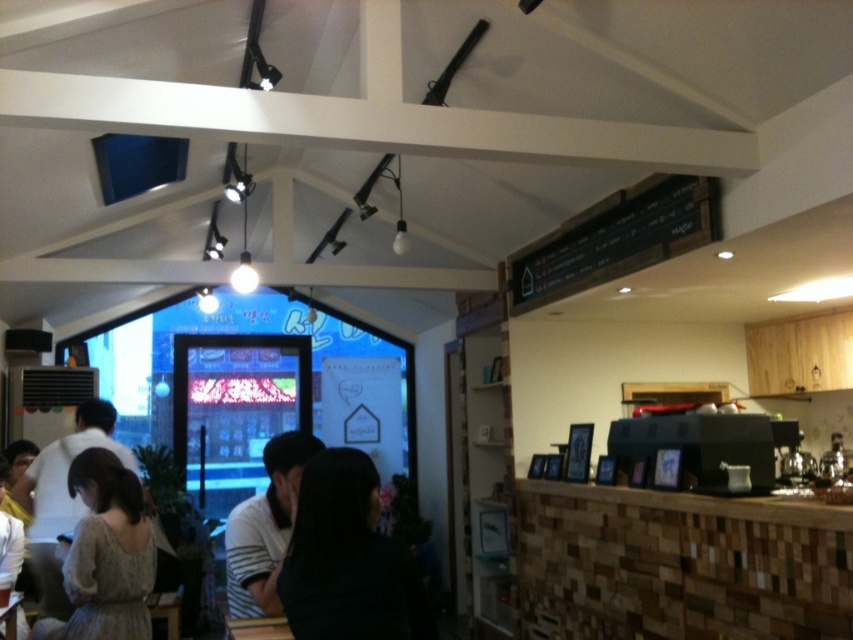
You are a customer in the cozy cafe and you see a knitted sweater at lower left and a white striped shirt at center. Which clothing item is larger in size?

The knitted sweater at lower left is bigger than the white striped shirt at center.

You are a customer in the cafe and want to take a photo of both the dark hair at center and the knitted sweater at lower left. Which object should you zoom in on to capture both in the frame without cropping?

You should zoom in on the knitted sweater at lower left because the dark hair at center occupies less space than the knitted sweater at lower left, making it smaller and easier to fit both in the frame.